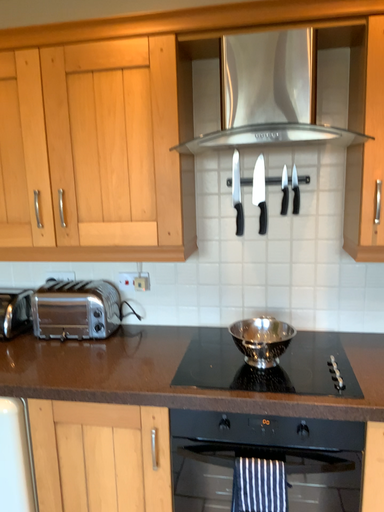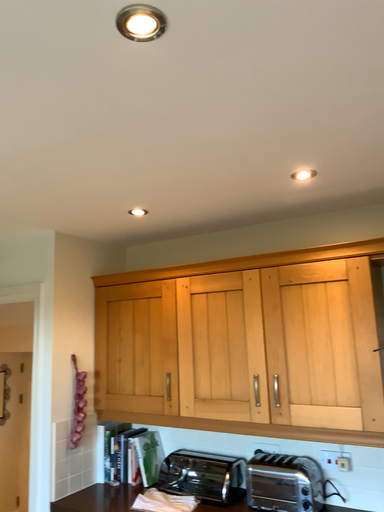
Question: How did the camera likely rotate when shooting the video?

Choices:
 (A) rotated downward
 (B) rotated upward

Answer: (B)